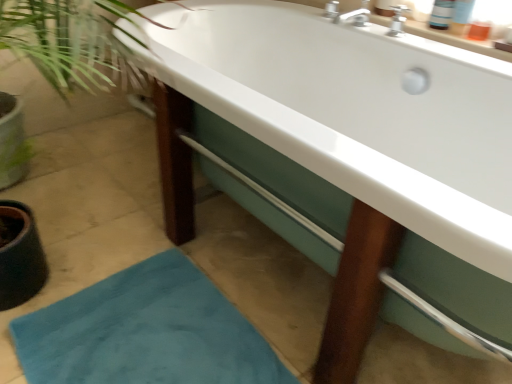
Question: Should I look upward or downward to see white glossy bathtub at center?

Choices:
 (A) down
 (B) up

Answer: (B)

Question: From a real-world perspective, is teal plush bath mat at lower left physically below white glossy bathtub at center?

Choices:
 (A) yes
 (B) no

Answer: (A)

Question: Is teal plush bath mat at lower left directly adjacent to white glossy bathtub at center?

Choices:
 (A) yes
 (B) no

Answer: (B)

Question: From the image's perspective, is teal plush bath mat at lower left located beneath white glossy bathtub at center?

Choices:
 (A) no
 (B) yes

Answer: (B)

Question: Is white glossy bathtub at center surrounded by teal plush bath mat at lower left?

Choices:
 (A) no
 (B) yes

Answer: (A)

Question: Considering the relative sizes of teal plush bath mat at lower left and white glossy bathtub at center in the image provided, is teal plush bath mat at lower left smaller than white glossy bathtub at center?

Choices:
 (A) yes
 (B) no

Answer: (A)

Question: From the image's perspective, is teal plush bath mat at lower left above white glossy bathtub at center?

Choices:
 (A) yes
 (B) no

Answer: (B)

Question: Is white glossy bathtub at center to the right of teal plush bath mat at lower left from the viewer's perspective?

Choices:
 (A) yes
 (B) no

Answer: (A)

Question: Is white glossy bathtub at center wider than teal plush bath mat at lower left?

Choices:
 (A) no
 (B) yes

Answer: (B)

Question: Does white glossy bathtub at center have a lesser width compared to teal plush bath mat at lower left?

Choices:
 (A) no
 (B) yes

Answer: (A)

Question: Can you confirm if white glossy bathtub at center is smaller than teal plush bath mat at lower left?

Choices:
 (A) no
 (B) yes

Answer: (A)

Question: Is white glossy bathtub at center positioned behind teal plush bath mat at lower left?

Choices:
 (A) yes
 (B) no

Answer: (B)

Question: Is white glossy bathtub at center turned away from teal plush bath mat at lower left?

Choices:
 (A) no
 (B) yes

Answer: (A)

Question: Considering the positions of teal plush bath mat at lower left and white glossy bathtub at center in the image, is teal plush bath mat at lower left wider or thinner than white glossy bathtub at center?

Choices:
 (A) thin
 (B) wide

Answer: (A)